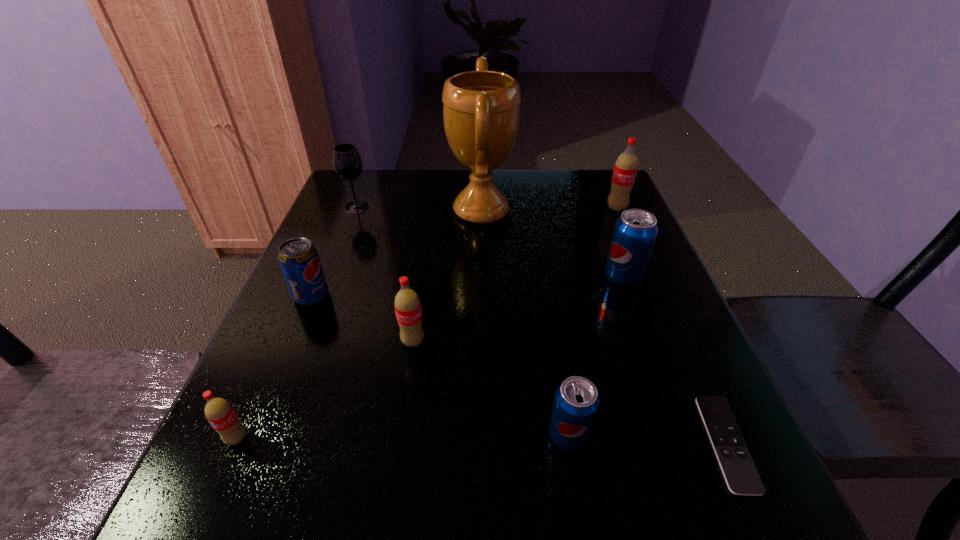
Point out which object is positioned as the third nearest to the nearer blue pop soda. Please provide its 2D coordinates. Your answer should be formatted as a tuple, i.e. [(x, y)], where the tuple contains the x and y coordinates of a point satisfying the conditions above.

[(635, 232)]

Where is `object that is the eighth closest to the biggest red soda`? The image size is (960, 540). object that is the eighth closest to the biggest red soda is located at coordinates (219, 412).

Image resolution: width=960 pixels, height=540 pixels. I want to click on the closest pop soda to the right blue pop soda, so click(625, 169).

Select which pop soda appears as the fourth closest to the wineglass. Please provide its 2D coordinates. Your answer should be formatted as a tuple, i.e. [(x, y)], where the tuple contains the x and y coordinates of a point satisfying the conditions above.

[(219, 412)]

Identify which red soda is the nearest to the farthest red soda. Please provide its 2D coordinates. Your answer should be formatted as a tuple, i.e. [(x, y)], where the tuple contains the x and y coordinates of a point satisfying the conditions above.

[(407, 304)]

I want to click on red soda that is the third closest to the right blue pop soda, so click(219, 412).

At what (x,y) coordinates should I click in order to perform the action: click on vacant space that satisfies the following two spatial constraints: 1. on the front side of the tallest pop soda; 2. on the right side of the shortest object. Please return your answer as a coordinate pair (x, y). Image resolution: width=960 pixels, height=540 pixels. Looking at the image, I should click on (718, 443).

Find the location of a particular element. Image resolution: width=960 pixels, height=540 pixels. vacant point that satisfies the following two spatial constraints: 1. on the front side of the remote control; 2. on the left side of the right blue pop soda is located at coordinates click(x=684, y=443).

You are a GUI agent. You are given a task and a screenshot of the screen. Output one action in this format:
    pyautogui.click(x=<x>, y=<y>)
    Task: Click on the vacant space that satisfies the following two spatial constraints: 1. on the front side of the wineglass; 2. on the left side of the right blue pop soda
    
    Given the screenshot: What is the action you would take?
    pyautogui.click(x=329, y=277)

You are a GUI agent. You are given a task and a screenshot of the screen. Output one action in this format:
    pyautogui.click(x=<x>, y=<y>)
    Task: Click on the free location that satisfies the following two spatial constraints: 1. on the front of the tallest object with the decoration; 2. on the left side of the smaller blue pop soda
    The width and height of the screenshot is (960, 540).
    Given the screenshot: What is the action you would take?
    pyautogui.click(x=482, y=435)